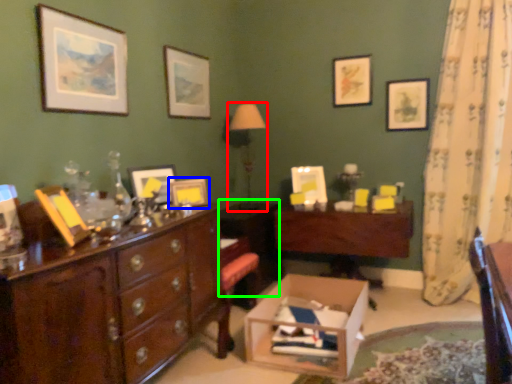
Question: Which is nearer to the table lamp (highlighted by a red box)? picture frame (highlighted by a blue box) or cabinetry (highlighted by a green box).

Choices:
 (A) picture frame
 (B) cabinetry

Answer: (B)